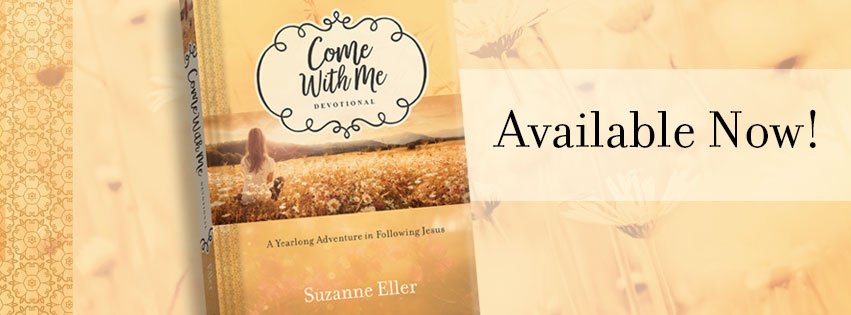
In order to click on book in this screenshot , I will do `click(420, 267)`.